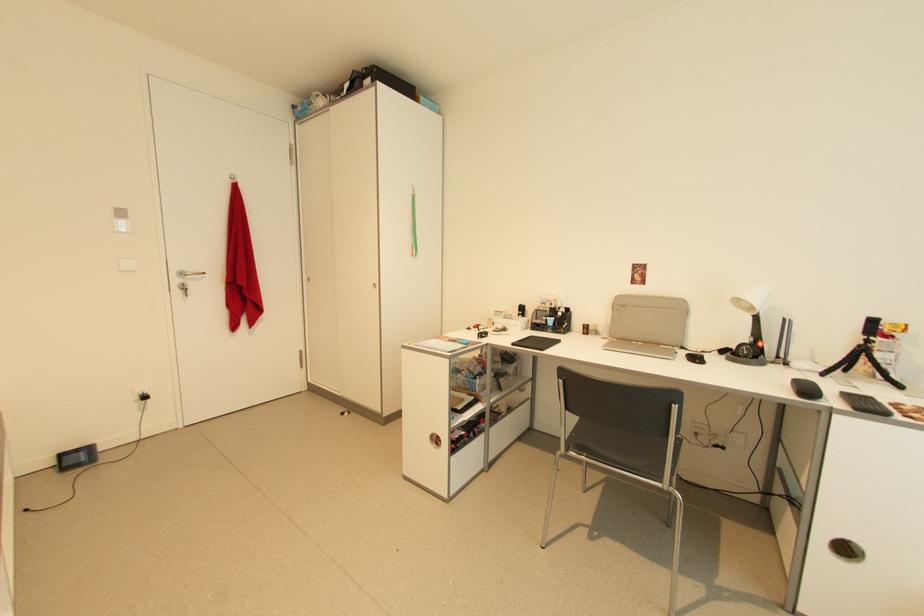
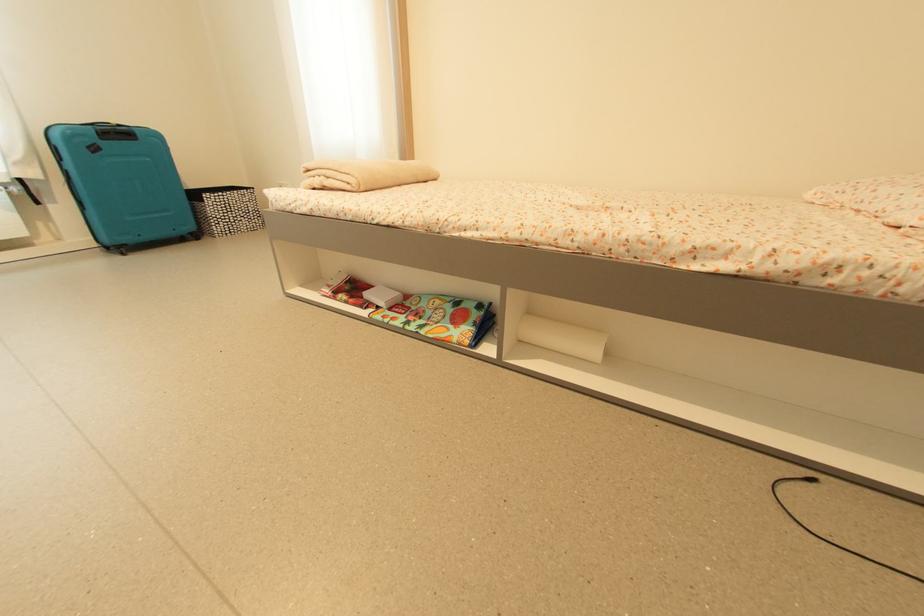
Question: I am providing you with two images of the same scene from different viewpoints. Which of the following objects are not visible in image2?

Choices:
 (A) red magazine
 (B) black power cable
 (C) patterned storage basket
 (D) none of these

Answer: (D)